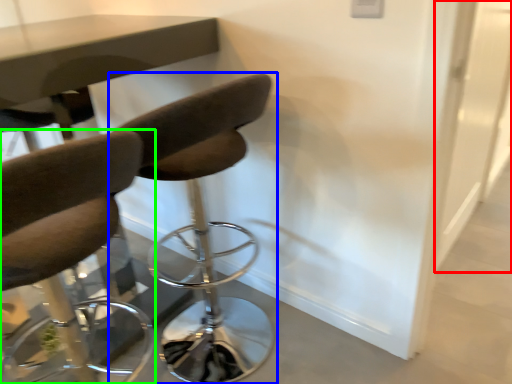
Question: Considering the real-world distances, which object is closest to glass door (highlighted by a red box)? chair (highlighted by a blue box) or chair (highlighted by a green box).

Choices:
 (A) chair
 (B) chair

Answer: (A)